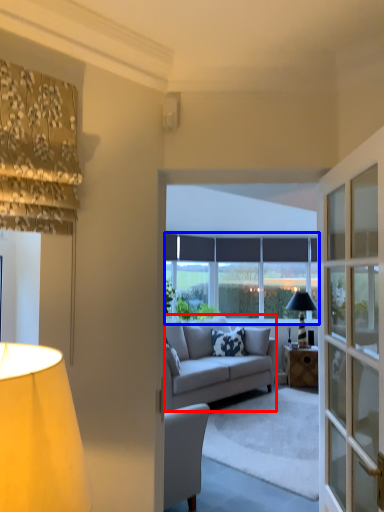
Question: Which point is further to the camera, studio couch (highlighted by a red box) or window (highlighted by a blue box)?

Choices:
 (A) studio couch
 (B) window

Answer: (B)